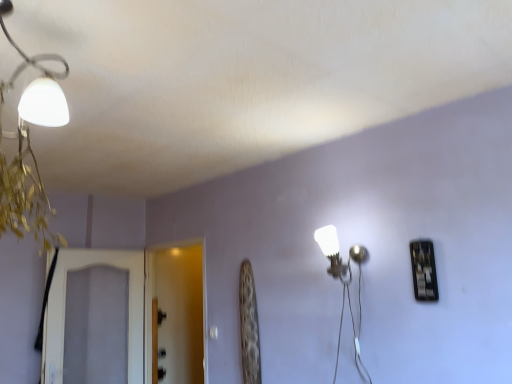
Based on the photo, what is the approximate width of white textured screen door at left, the 1th screen door viewed from the left?

4.20 inches.

The width and height of the screenshot is (512, 384). In order to click on white textured screen door at left, acting as the 2th screen door starting from the right in this screenshot , I will do `click(65, 305)`.

What do you see at coordinates (176, 314) in the screenshot? This screenshot has height=384, width=512. I see `transparent glass screen door at center, the first screen door in the right-to-left sequence` at bounding box center [176, 314].

What do you see at coordinates (343, 282) in the screenshot? I see `white glossy wall lamp at center-right` at bounding box center [343, 282].

Where is `white textured screen door at left, acting as the 2th screen door starting from the right`? Image resolution: width=512 pixels, height=384 pixels. white textured screen door at left, acting as the 2th screen door starting from the right is located at coordinates (65, 305).

Is point (197, 274) less distant than point (60, 311)?

No.

Does transparent glass screen door at center, the first screen door in the right-to-left sequence, touch white textured screen door at left, the 1th screen door viewed from the left?

No.

Locate an element on the screen. The width and height of the screenshot is (512, 384). screen door that appears on the left of transparent glass screen door at center, the first screen door in the right-to-left sequence is located at coordinates (65, 305).

Is white glossy wall lamp at center-right to the left or to the right of transparent glass screen door at center, the first screen door in the right-to-left sequence, in the image?

From the image, it's evident that white glossy wall lamp at center-right is to the right of transparent glass screen door at center, the first screen door in the right-to-left sequence.

Who is shorter, white glossy wall lamp at center-right or transparent glass screen door at center, the 2th screen door from the left?

white glossy wall lamp at center-right.

Is white glossy wall lamp at center-right facing away from transparent glass screen door at center, the 2th screen door from the left?

white glossy wall lamp at center-right is not turned away from transparent glass screen door at center, the 2th screen door from the left.

What's the angular difference between white glossy wall lamp at center-right and transparent glass screen door at center, the 2th screen door from the left,'s facing directions?

The angular difference between white glossy wall lamp at center-right and transparent glass screen door at center, the 2th screen door from the left, is 0.000215 degrees.

Does white glossy wall lamp at center-right have a larger size compared to white textured screen door at left, the 1th screen door viewed from the left?

Actually, white glossy wall lamp at center-right might be smaller than white textured screen door at left, the 1th screen door viewed from the left.

Between white glossy wall lamp at center-right and white textured screen door at left, the 1th screen door viewed from the left, which one is positioned behind?

white textured screen door at left, the 1th screen door viewed from the left, is further from the camera.

Can you confirm if white glossy wall lamp at center-right is thinner than white textured screen door at left, the 1th screen door viewed from the left?

In fact, white glossy wall lamp at center-right might be wider than white textured screen door at left, the 1th screen door viewed from the left.

How many degrees apart are the facing directions of white glossy wall lamp at center-right and white textured screen door at left, the 1th screen door viewed from the left?

white glossy wall lamp at center-right and white textured screen door at left, the 1th screen door viewed from the left, are facing 93.7 degrees away from each other.

In the scene shown: Between transparent glass screen door at center, the first screen door in the right-to-left sequence, and white glossy wall lamp at center-right, which one has smaller size?

With smaller size is white glossy wall lamp at center-right.

Is the surface of transparent glass screen door at center, the 2th screen door from the left, in direct contact with white glossy wall lamp at center-right?

No, transparent glass screen door at center, the 2th screen door from the left, is not making contact with white glossy wall lamp at center-right.

Would you say transparent glass screen door at center, the first screen door in the right-to-left sequence, is to the left or to the right of white glossy wall lamp at center-right in the picture?

Clearly, transparent glass screen door at center, the first screen door in the right-to-left sequence, is on the left of white glossy wall lamp at center-right in the image.

How many degrees apart are the facing directions of transparent glass screen door at center, the 2th screen door from the left, and white glossy wall lamp at center-right?

The angular difference between transparent glass screen door at center, the 2th screen door from the left, and white glossy wall lamp at center-right is 0.000215 degrees.

Looking at their sizes, would you say white textured screen door at left, acting as the 2th screen door starting from the right, is wider or thinner than transparent glass screen door at center, the 2th screen door from the left?

white textured screen door at left, acting as the 2th screen door starting from the right, is thinner than transparent glass screen door at center, the 2th screen door from the left.

Which of these two, white textured screen door at left, the 1th screen door viewed from the left, or transparent glass screen door at center, the first screen door in the right-to-left sequence, is smaller?

Smaller between the two is white textured screen door at left, the 1th screen door viewed from the left.

Which is closer to the camera, (127, 363) or (201, 365)?

Clearly, point (127, 363) is closer to the camera than point (201, 365).

Measure the distance between white textured screen door at left, the 1th screen door viewed from the left, and transparent glass screen door at center, the 2th screen door from the left.

white textured screen door at left, the 1th screen door viewed from the left, and transparent glass screen door at center, the 2th screen door from the left, are 41.79 centimeters apart from each other.

Is white textured screen door at left, acting as the 2th screen door starting from the right, not close to white glossy wall lamp at center-right?

Yes.

Which of these two, white textured screen door at left, the 1th screen door viewed from the left, or white glossy wall lamp at center-right, stands shorter?

With less height is white glossy wall lamp at center-right.

From the image's perspective, which one is positioned lower, white textured screen door at left, acting as the 2th screen door starting from the right, or white glossy wall lamp at center-right?

white textured screen door at left, acting as the 2th screen door starting from the right, appears lower in the image.

Find the location of a particular element. screen door in front of the transparent glass screen door at center, the 2th screen door from the left is located at coordinates (65, 305).

Where is `screen door that is the 2nd one when counting backward from the white glossy wall lamp at center-right`? The image size is (512, 384). screen door that is the 2nd one when counting backward from the white glossy wall lamp at center-right is located at coordinates (176, 314).

Estimate the real-world distances between objects in this image. Which object is closer to transparent glass screen door at center, the first screen door in the right-to-left sequence, white glossy wall lamp at center-right or white textured screen door at left, acting as the 2th screen door starting from the right?

white textured screen door at left, acting as the 2th screen door starting from the right, lies closer to transparent glass screen door at center, the first screen door in the right-to-left sequence, than the other object.

Estimate the real-world distances between objects in this image. Which object is further from white textured screen door at left, acting as the 2th screen door starting from the right, transparent glass screen door at center, the first screen door in the right-to-left sequence, or white glossy wall lamp at center-right?

white glossy wall lamp at center-right is positioned further to the anchor white textured screen door at left, acting as the 2th screen door starting from the right.

Which object lies further to the anchor point white glossy wall lamp at center-right, transparent glass screen door at center, the 2th screen door from the left, or white textured screen door at left, acting as the 2th screen door starting from the right?

transparent glass screen door at center, the 2th screen door from the left, is positioned further to the anchor white glossy wall lamp at center-right.

From the image, which object appears to be farther from white glossy wall lamp at center-right, white textured screen door at left, the 1th screen door viewed from the left, or transparent glass screen door at center, the 2th screen door from the left?

The object further to white glossy wall lamp at center-right is transparent glass screen door at center, the 2th screen door from the left.

Which object lies further to the anchor point white textured screen door at left, acting as the 2th screen door starting from the right, white glossy wall lamp at center-right or transparent glass screen door at center, the first screen door in the right-to-left sequence?

white glossy wall lamp at center-right.

Which object lies further to the anchor point transparent glass screen door at center, the 2th screen door from the left, white textured screen door at left, the 1th screen door viewed from the left, or white glossy wall lamp at center-right?

white glossy wall lamp at center-right.

I want to click on screen door between white textured screen door at left, acting as the 2th screen door starting from the right, and white glossy wall lamp at center-right, so click(176, 314).